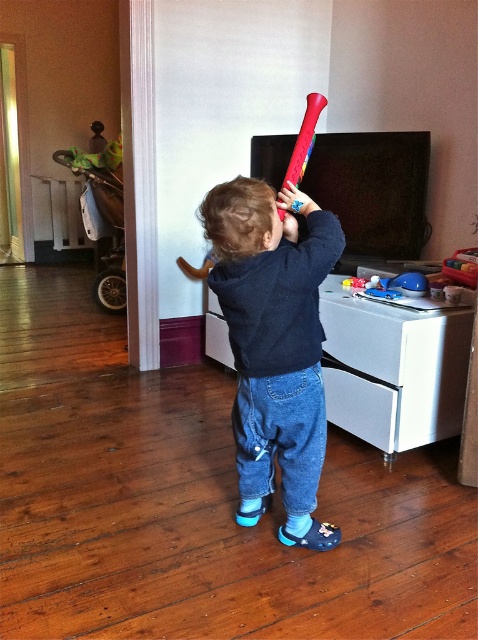
Question: Considering the real-world distances, which object is closest to the matte plastic bat at center?

Choices:
 (A) brown matte hair at center
 (B) rubberized red baseball bat at upper center

Answer: (A)

Question: Which point is closer to the camera?

Choices:
 (A) (295, 148)
 (B) (238, 204)
 (C) (311, 221)

Answer: (B)

Question: Considering the real-world distances, which object is closest to the rubberized red baseball bat at upper center?

Choices:
 (A) brown matte hair at center
 (B) matte plastic bat at center

Answer: (A)

Question: Is matte plastic bat at center positioned in front of brown matte hair at center?

Choices:
 (A) yes
 (B) no

Answer: (B)

Question: Does matte plastic bat at center come behind brown matte hair at center?

Choices:
 (A) yes
 (B) no

Answer: (A)

Question: Is matte plastic bat at center to the left of rubberized red baseball bat at upper center from the viewer's perspective?

Choices:
 (A) yes
 (B) no

Answer: (A)